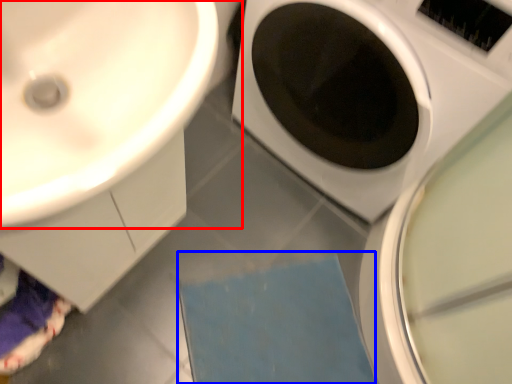
Question: Which of the following is the farthest to the observer, sink (highlighted by a red box) or bath mat (highlighted by a blue box)?

Choices:
 (A) sink
 (B) bath mat

Answer: (B)